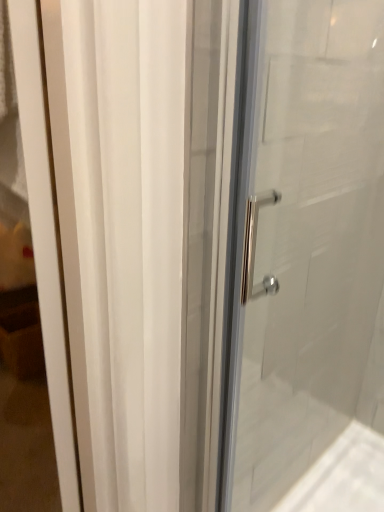
This screenshot has height=512, width=384. Find the location of `polished silver handle at right`. polished silver handle at right is located at coordinates (314, 242).

The height and width of the screenshot is (512, 384). What do you see at coordinates (314, 242) in the screenshot?
I see `polished silver handle at right` at bounding box center [314, 242].

Find the location of a particular element. polished silver handle at right is located at coordinates (314, 242).